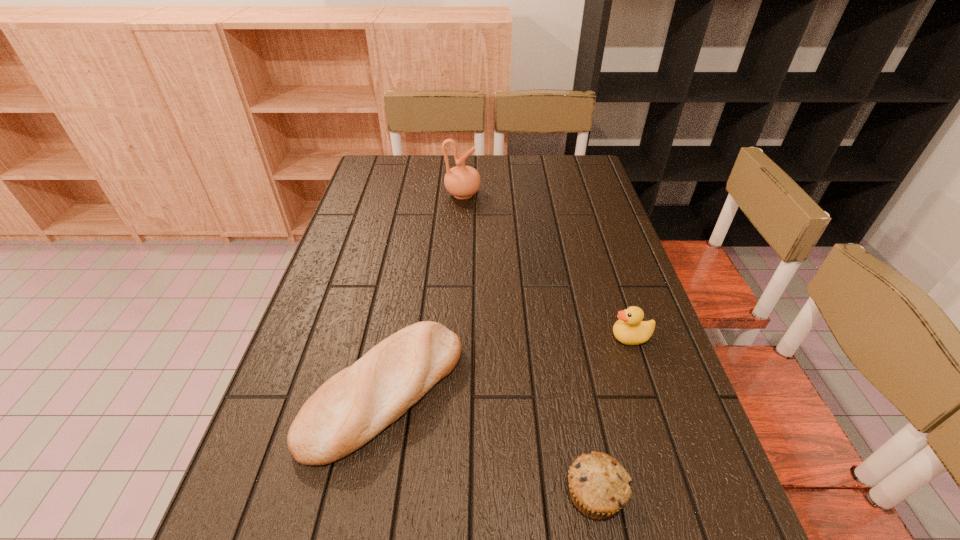
The height and width of the screenshot is (540, 960). Find the location of `free spot located 0.300m on the left of the second object from right to left`. free spot located 0.300m on the left of the second object from right to left is located at coordinates (394, 494).

Locate an element on the screen. This screenshot has height=540, width=960. object at the far edge is located at coordinates (461, 181).

Where is `object present at the left edge`? object present at the left edge is located at coordinates (x=353, y=406).

Locate an element on the screen. object that is at the right edge is located at coordinates (630, 329).

I want to click on vacant area at the far edge of the desktop, so click(x=523, y=164).

In the image, there is a desktop. What are the coordinates of `vacant space at the left edge` in the screenshot? It's located at (366, 256).

Image resolution: width=960 pixels, height=540 pixels. In order to click on vacant space at the right edge in this screenshot , I will do `click(606, 200)`.

Locate an element on the screen. This screenshot has height=540, width=960. vacant space at the far right corner of the desktop is located at coordinates (564, 163).

Image resolution: width=960 pixels, height=540 pixels. In order to click on free area in between the farthest object and the bread in this screenshot , I will do `click(423, 293)`.

The width and height of the screenshot is (960, 540). In order to click on free spot between the rightmost object and the farthest object in this screenshot , I will do `click(547, 266)`.